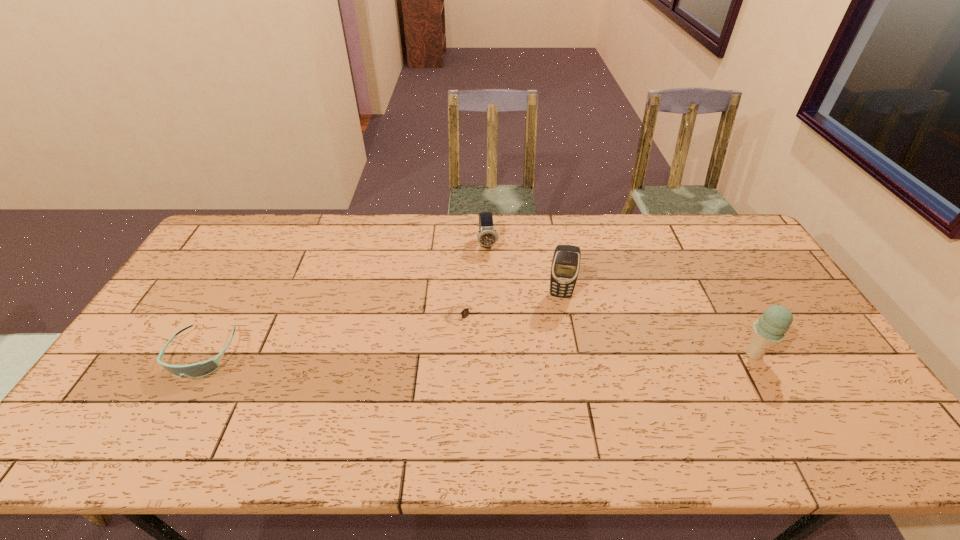
I want to click on vacant position in the image that satisfies the following two spatial constraints: 1. on the back side of the cellular telephone; 2. on the left side of the shorter watch, so click(x=462, y=295).

The height and width of the screenshot is (540, 960). I want to click on vacant space that satisfies the following two spatial constraints: 1. on the front-facing side of the ice cream; 2. on the left side of the leftmost object, so click(x=203, y=354).

Where is `vacant point that satisfies the following two spatial constraints: 1. on the front side of the rightmost object; 2. on the left side of the shorter watch`? The width and height of the screenshot is (960, 540). vacant point that satisfies the following two spatial constraints: 1. on the front side of the rightmost object; 2. on the left side of the shorter watch is located at coordinates (459, 354).

Where is `vacant space that satisfies the following two spatial constraints: 1. on the front-facing side of the fourth tallest object; 2. on the right side of the rightmost object`? vacant space that satisfies the following two spatial constraints: 1. on the front-facing side of the fourth tallest object; 2. on the right side of the rightmost object is located at coordinates (203, 354).